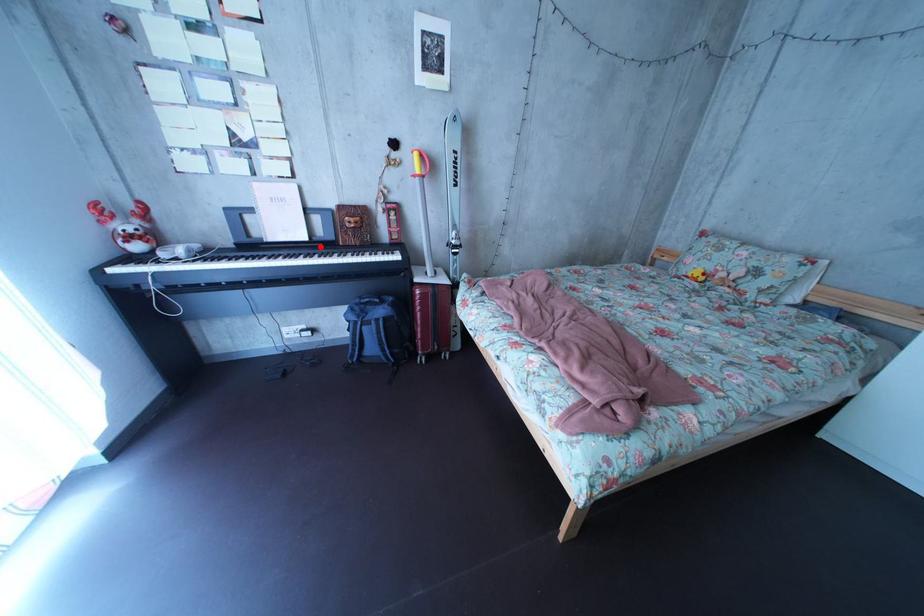
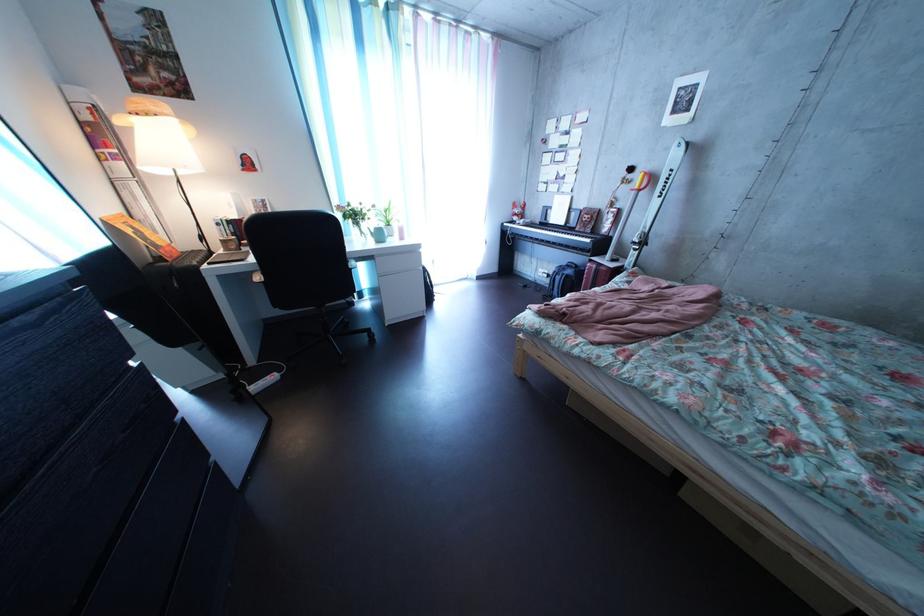
Locate, in the second image, the point that corresponds to the highlighted location in the first image.

(577, 232)